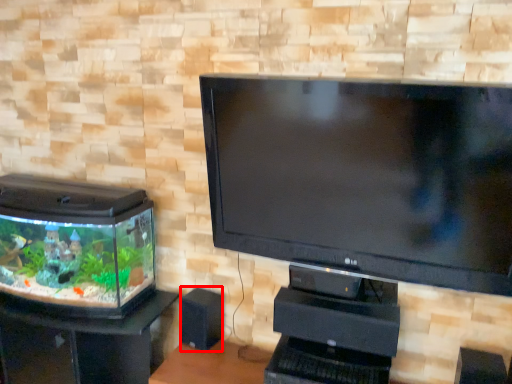
Question: Where is speaker (annotated by the red box) located in relation to furniture in the image?

Choices:
 (A) left
 (B) right

Answer: (B)